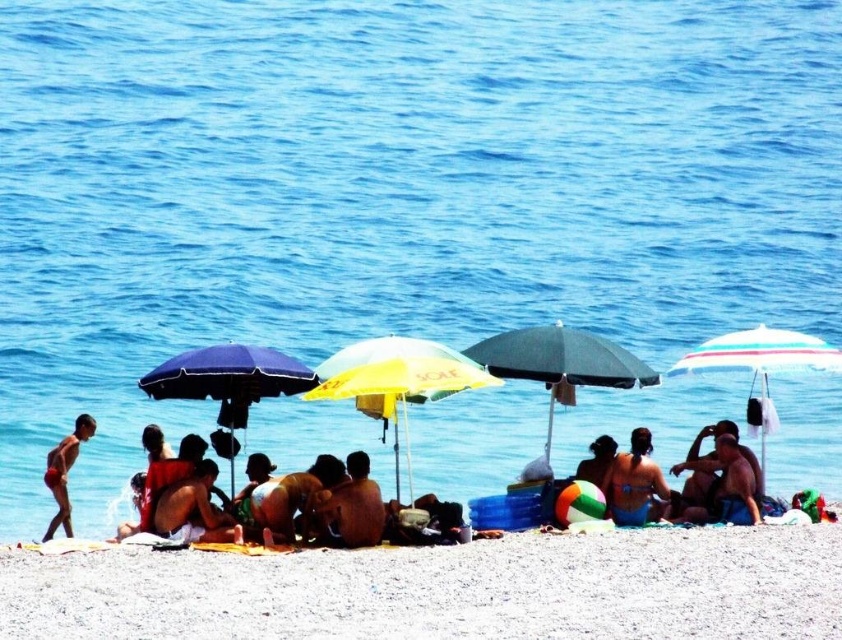
Which is more to the right, yellow fabric umbrella at center or beige fabric towel at center?

yellow fabric umbrella at center

Can you confirm if yellow fabric umbrella at center is positioned below beige fabric towel at center?

Incorrect, yellow fabric umbrella at center is not positioned below beige fabric towel at center.

Does point (445, 368) come closer to viewer compared to point (204, 531)?

No, (445, 368) is further to viewer.

In order to click on yellow fabric umbrella at center in this screenshot , I will do [396, 380].

Who is higher up, beige sand at lower center or blue fabric umbrella at center left?

blue fabric umbrella at center left is higher up.

Does beige sand at lower center have a lesser width compared to blue fabric umbrella at center left?

Incorrect, beige sand at lower center's width is not less than blue fabric umbrella at center left's.

Find the location of a particular element. The width and height of the screenshot is (842, 640). beige sand at lower center is located at coordinates (445, 589).

The image size is (842, 640). Identify the location of beige sand at lower center. (445, 589).

Does brown textured towel at center have a lesser width compared to matte blue bikini at center?

In fact, brown textured towel at center might be wider than matte blue bikini at center.

Between brown textured towel at center and matte blue bikini at center, which one is positioned higher?

matte blue bikini at center

Is point (374, 490) more distant than point (649, 484)?

That is False.

Find the location of a particular element. The width and height of the screenshot is (842, 640). brown textured towel at center is located at coordinates (350, 508).